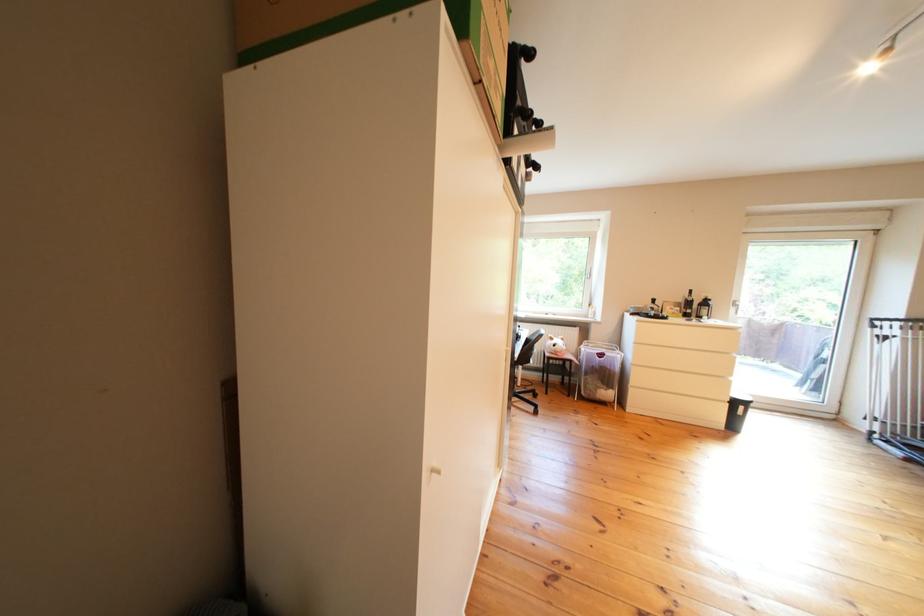
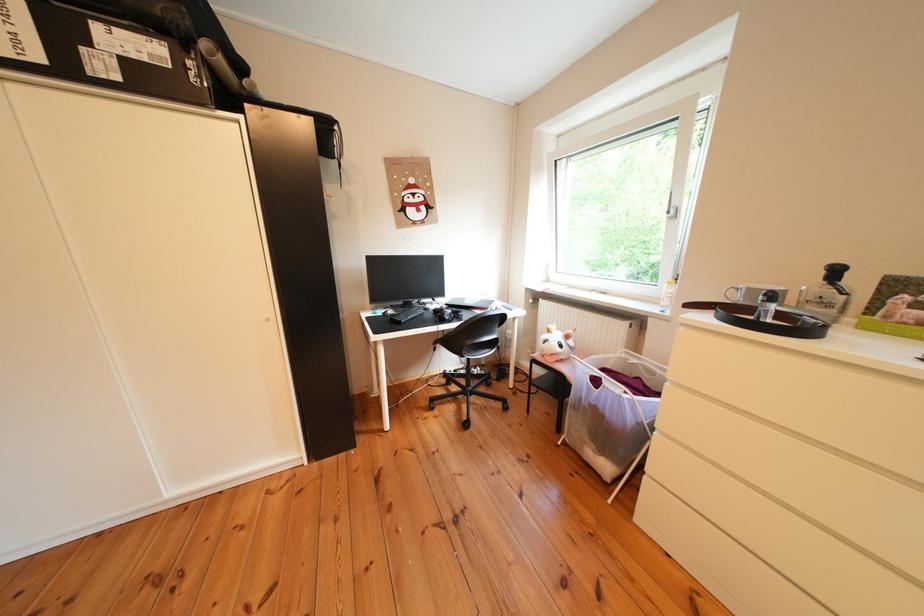
The point at (614,389) is marked in the first image. Where is the corresponding point in the second image?

(601, 442)